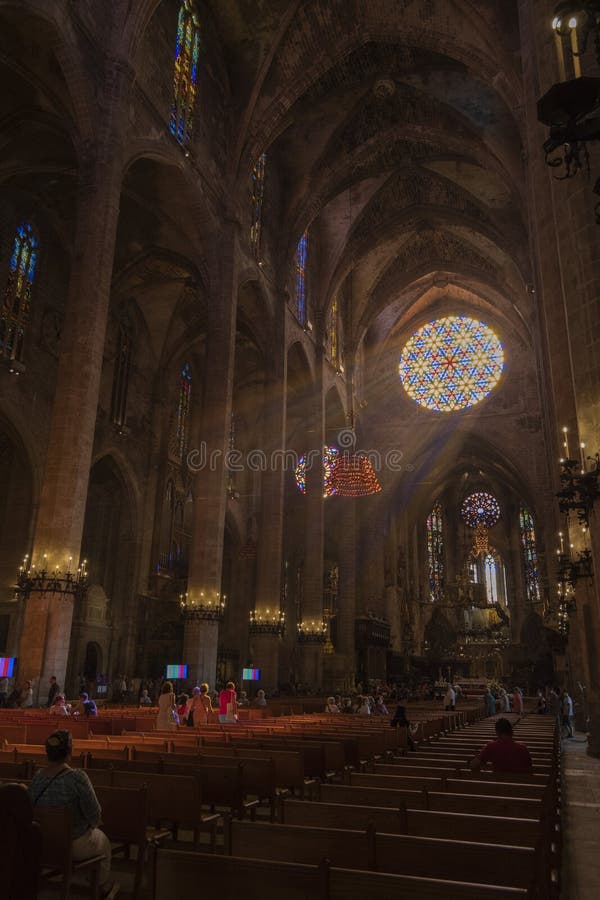
This screenshot has width=600, height=900. What are the coordinates of `monitors` in the screenshot? It's located at (247, 673), (178, 672).